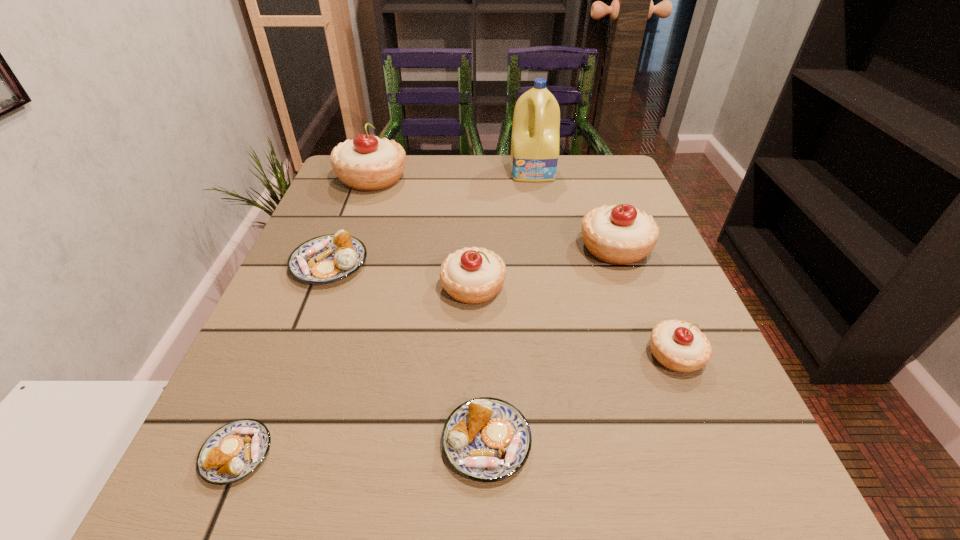
Where is `the third object from right to left`? This screenshot has height=540, width=960. the third object from right to left is located at coordinates (535, 138).

Where is `the tallest object`? The image size is (960, 540). the tallest object is located at coordinates (535, 138).

Locate an element on the screen. This screenshot has width=960, height=540. the biggest beige pastry is located at coordinates tap(367, 163).

Identify the location of the tallest pastry. (367, 163).

Where is `the second tallest pastry`? the second tallest pastry is located at coordinates (621, 234).

You are a GUI agent. You are given a task and a screenshot of the screen. Output one action in this format:
    pyautogui.click(x=<x>, y=<y>)
    Task: Click on the second biggest beige pastry
    
    Given the screenshot: What is the action you would take?
    pyautogui.click(x=621, y=234)

The image size is (960, 540). What are the coordinates of `the second beige pastry from left to right` in the screenshot? It's located at (473, 275).

The image size is (960, 540). I want to click on the third biggest beige pastry, so click(x=473, y=275).

Where is `the smallest beige pastry`? the smallest beige pastry is located at coordinates (679, 346).

Where is `the sixth farthest object`? This screenshot has width=960, height=540. the sixth farthest object is located at coordinates (679, 346).